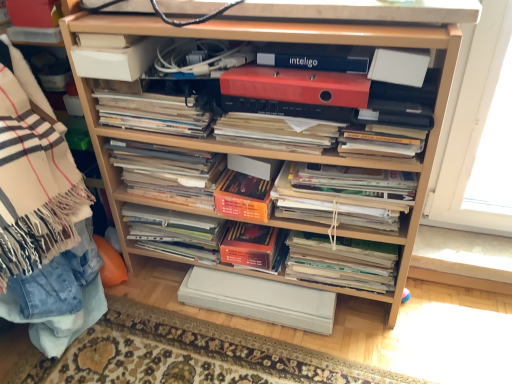
Locate an element on the screen. The height and width of the screenshot is (384, 512). free point above wooden shelf at center (from a real-world perspective) is located at coordinates (214, 14).